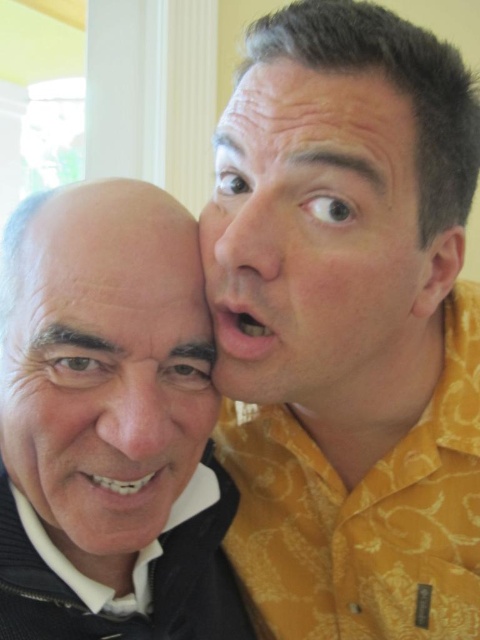
Does matte black face at left have a greater width compared to smooth skin face at right?

Incorrect, matte black face at left's width does not surpass smooth skin face at right's.

Does matte black face at left have a lesser height compared to smooth skin face at right?

No.

Which is in front, point (92, 576) or point (317, 88)?

Point (317, 88) is in front.

Where is `matte black face at left`? matte black face at left is located at coordinates (109, 424).

Is smooth skin face at right wider than dry skin at center?

Yes, smooth skin face at right is wider than dry skin at center.

Which of these two, smooth skin face at right or dry skin at center, stands shorter?

With less height is dry skin at center.

Does point (236, 216) come in front of point (23, 285)?

No, it is not.

At what (x,y) coordinates should I click in order to perform the action: click on smooth skin face at right. Please return your answer as a coordinate pair (x, y). Looking at the image, I should click on (317, 244).

Who is taller, smooth skin nose at center or smooth skin nose at upper center?

Standing taller between the two is smooth skin nose at upper center.

Who is lower down, smooth skin nose at center or smooth skin nose at upper center?

A: smooth skin nose at center is below.

Image resolution: width=480 pixels, height=640 pixels. I want to click on smooth skin nose at center, so click(136, 412).